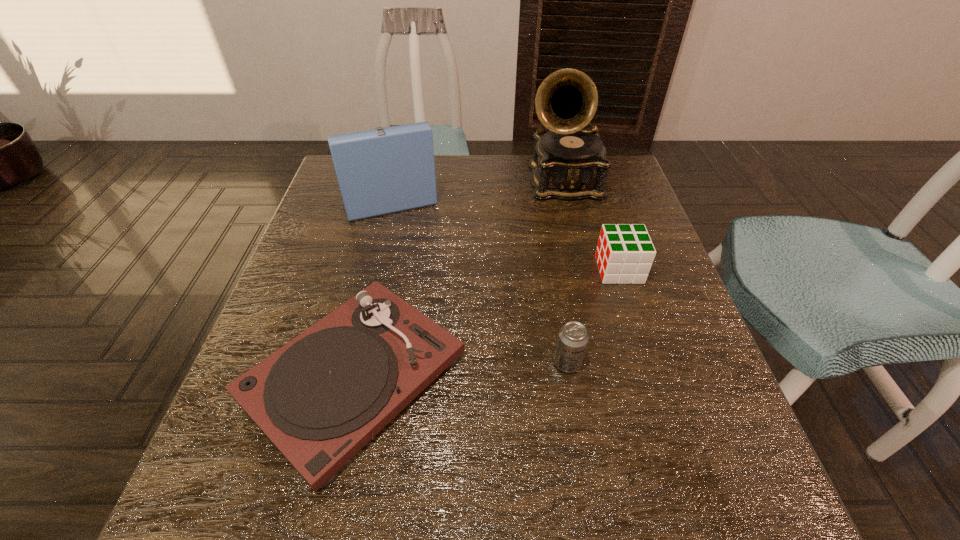
Find the location of a particular element. This screenshot has width=960, height=540. free space between the rightmost phonograph_record and the beer can is located at coordinates click(x=565, y=273).

Image resolution: width=960 pixels, height=540 pixels. In order to click on unoccupied position between the cube and the tallest phonograph_record in this screenshot , I will do `click(591, 226)`.

Find the location of `free space between the tallest phonograph_record and the nearest phonograph_record`. free space between the tallest phonograph_record and the nearest phonograph_record is located at coordinates (x=459, y=279).

Where is `free space between the second shortest phonograph_record and the rightmost phonograph_record`? Image resolution: width=960 pixels, height=540 pixels. free space between the second shortest phonograph_record and the rightmost phonograph_record is located at coordinates (474, 185).

The height and width of the screenshot is (540, 960). I want to click on free point between the beer can and the second tallest object, so click(477, 275).

Find the location of a particular element. The width and height of the screenshot is (960, 540). free space that is in between the cube and the rightmost phonograph_record is located at coordinates (591, 226).

I want to click on vacant area between the beer can and the tallest phonograph_record, so [565, 273].

Find the location of a particular element. The image size is (960, 540). object that is the third nearest to the rightmost phonograph_record is located at coordinates (320, 398).

At what (x,y) coordinates should I click in order to perform the action: click on the third closest object to the beer can. Please return your answer as a coordinate pair (x, y). Looking at the image, I should click on (569, 163).

The width and height of the screenshot is (960, 540). What are the coordinates of `phonograph_record that can be found as the third closest to the beer can` in the screenshot? It's located at (381, 171).